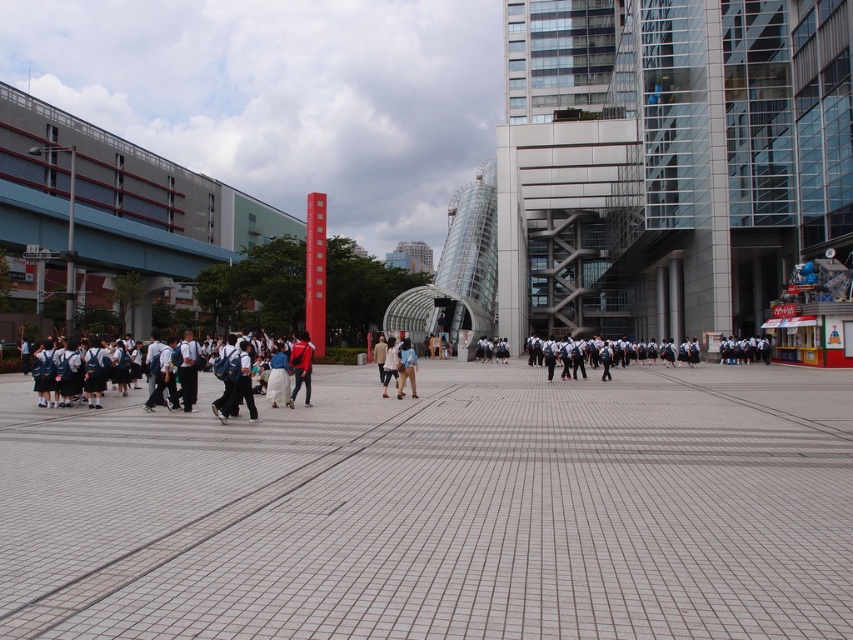
Question: Which object is the closest to the light blue denim jacket at center?

Choices:
 (A) light brown leather jacket at center
 (B) white cotton shirt at center
 (C) red fabric jacket at center

Answer: (B)

Question: Observing the image, what is the correct spatial positioning of white uniform at left in reference to light brown leather jacket at center?

Choices:
 (A) right
 (B) left

Answer: (B)

Question: Estimate the real-world distances between objects in this image. Which object is farther from the gray tile pavement at center?

Choices:
 (A) red fabric jacket at center
 (B) white uniform at left
 (C) white cotton shirt at center
 (D) light blue denim jacket at center

Answer: (C)

Question: Is light blue denim jacket at center thinner than light brown leather jacket at center?

Choices:
 (A) yes
 (B) no

Answer: (A)

Question: Which point appears farthest from the camera in this image?

Choices:
 (A) (267, 364)
 (B) (387, 378)
 (C) (404, 349)
 (D) (297, 352)

Answer: (B)

Question: Is light blue denim jacket at center thinner than light brown leather jacket at center?

Choices:
 (A) yes
 (B) no

Answer: (A)